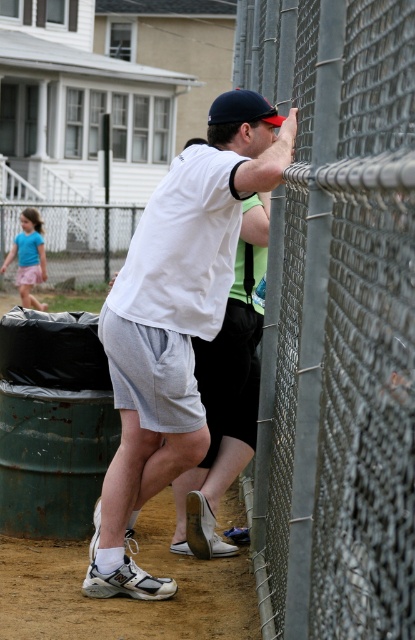
You are a photographer trying to capture a candid shot of the scene. You want to focus on the white matte shorts at center. Based on the scene description, where should you aim your camera to ensure the shorts are in the center of your photo?

You should aim your camera at the point specified by the coordinates (173,330) to ensure the white matte shorts at center are in the center of your photo.